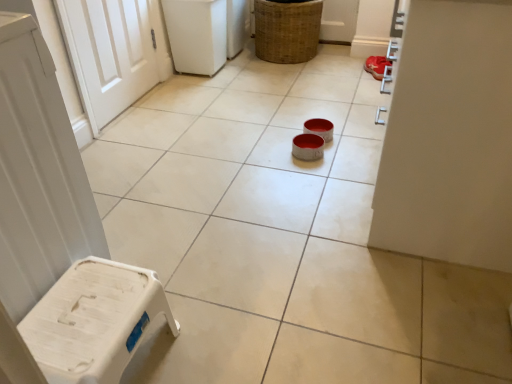
Find the location of `red suede shoe at upper right`. red suede shoe at upper right is located at coordinates (377, 66).

I want to click on woven brown basket at upper center, so click(287, 30).

Is red suede shoe at upper right not within woven brown basket at upper center?

Yes.

From a real-world perspective, relative to woven brown basket at upper center, is red suede shoe at upper right vertically above or below?

red suede shoe at upper right is below woven brown basket at upper center.

Which object is closer to the camera taking this photo, red suede shoe at upper right or woven brown basket at upper center?

Positioned in front is woven brown basket at upper center.

Is red suede shoe at upper right to the right of woven brown basket at upper center from the viewer's perspective?

Yes, red suede shoe at upper right is to the right of woven brown basket at upper center.

Is woven brown basket at upper center outside of red suede shoe at upper right?

Indeed, woven brown basket at upper center is completely outside red suede shoe at upper right.

From a real-world perspective, who is located higher, woven brown basket at upper center or red suede shoe at upper right?

From a 3D spatial view, woven brown basket at upper center is above.

Can you confirm if woven brown basket at upper center is thinner than red suede shoe at upper right?

No, woven brown basket at upper center is not thinner than red suede shoe at upper right.

Is woven brown basket at upper center smaller than red suede shoe at upper right?

No.

How much distance is there between white plastic stool at lower left and woven brown basket at upper center?

white plastic stool at lower left is 7.72 feet from woven brown basket at upper center.

Is white plastic stool at lower left in front of woven brown basket at upper center?

Yes, white plastic stool at lower left is closer to the camera.

Can you confirm if white plastic stool at lower left is positioned to the right of woven brown basket at upper center?

Incorrect, white plastic stool at lower left is not on the right side of woven brown basket at upper center.

Is white plastic stool at lower left next to red suede shoe at upper right?

No, white plastic stool at lower left is not touching red suede shoe at upper right.

Considering the positions of objects white plastic stool at lower left and red suede shoe at upper right in the image provided, who is more to the right, white plastic stool at lower left or red suede shoe at upper right?

red suede shoe at upper right is more to the right.

Does point (114, 365) come closer to viewer compared to point (384, 68)?

Yes, point (114, 365) is in front of point (384, 68).

From the image's perspective, is white plastic stool at lower left positioned above or below red suede shoe at upper right?

white plastic stool at lower left is below red suede shoe at upper right.

Which point is more distant from viewer, (x=377, y=57) or (x=56, y=328)?

The point (x=377, y=57) is more distant.

Does red suede shoe at upper right have a greater height compared to white plastic stool at lower left?

No.

Can you confirm if red suede shoe at upper right is positioned to the left of white plastic stool at lower left?

No.

Which object is positioned more to the left, woven brown basket at upper center or white plastic stool at lower left?

Positioned to the left is white plastic stool at lower left.

Is woven brown basket at upper center outside of white plastic stool at lower left?

Yes, woven brown basket at upper center is not within white plastic stool at lower left.

Which is in front, woven brown basket at upper center or white plastic stool at lower left?

white plastic stool at lower left.

Identify the location of basket on the left of the red suede shoe at upper right. The image size is (512, 384). (287, 30).

Locate an element on the screen. Image resolution: width=512 pixels, height=384 pixels. footwear below the woven brown basket at upper center (from the image's perspective) is located at coordinates (377, 66).

Consider the image. Considering their positions, is woven brown basket at upper center positioned further to red suede shoe at upper right than white plastic stool at lower left?

white plastic stool at lower left.

Estimate the real-world distances between objects in this image. Which object is closer to white plastic stool at lower left, woven brown basket at upper center or red suede shoe at upper right?

red suede shoe at upper right lies closer to white plastic stool at lower left than the other object.

Looking at the image, which one is located further to red suede shoe at upper right, white plastic stool at lower left or woven brown basket at upper center?

white plastic stool at lower left is further to red suede shoe at upper right.

Estimate the real-world distances between objects in this image. Which object is further from woven brown basket at upper center, white plastic stool at lower left or red suede shoe at upper right?

Based on the image, white plastic stool at lower left appears to be further to woven brown basket at upper center.

Which object lies nearer to the anchor point woven brown basket at upper center, red suede shoe at upper right or white plastic stool at lower left?

Among the two, red suede shoe at upper right is located nearer to woven brown basket at upper center.

From the image, which object appears to be farther from white plastic stool at lower left, red suede shoe at upper right or woven brown basket at upper center?

woven brown basket at upper center lies further to white plastic stool at lower left than the other object.

Image resolution: width=512 pixels, height=384 pixels. I want to click on basket between white plastic stool at lower left and red suede shoe at upper right in the front-back direction, so click(287, 30).